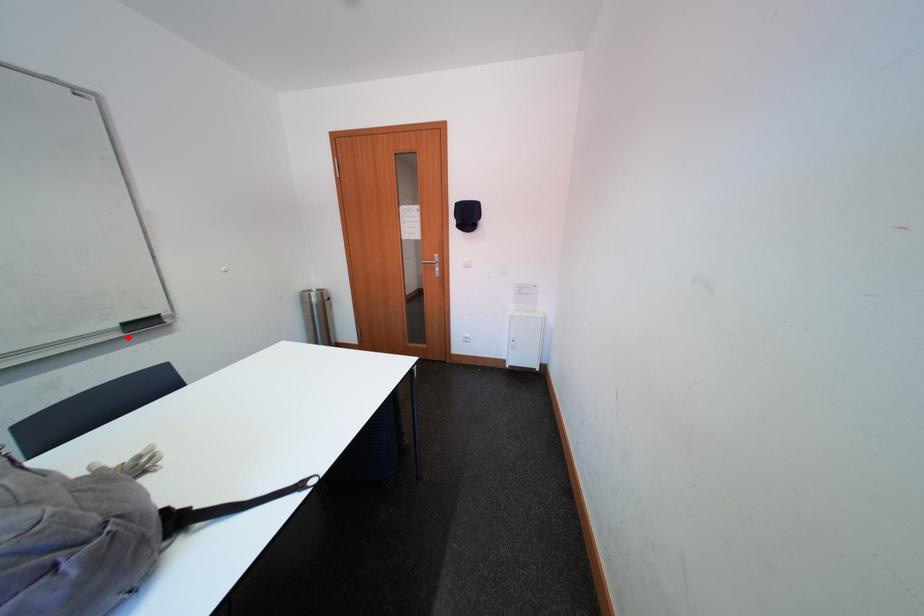
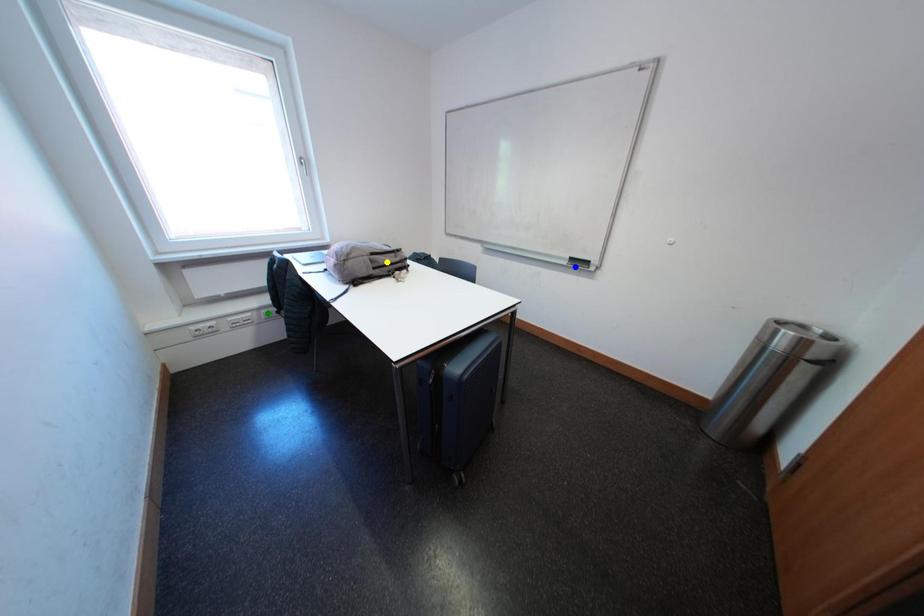
Question: I am providing you with two images of the same scene from different viewpoints. A red point is marked on the first image. You are given multiple points on the second image. Which point in image 2 is actually the same real-world point as the red point in image 1?

Choices:
 (A) yellow point
 (B) blue point
 (C) green point

Answer: (B)